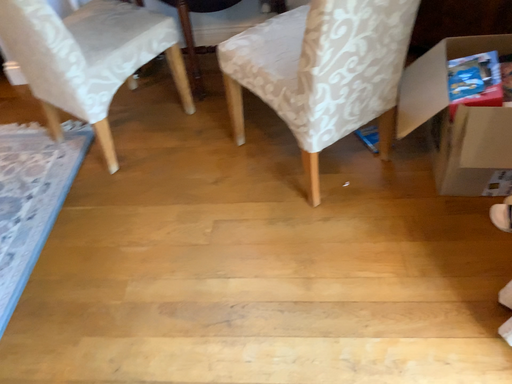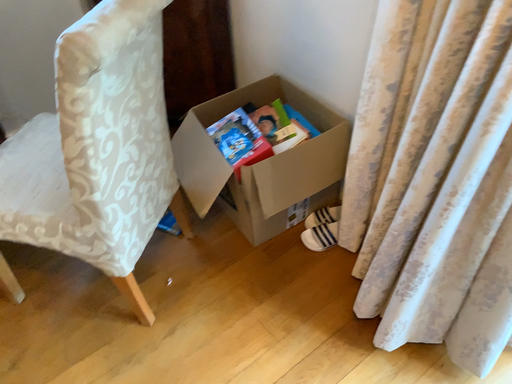
Question: How did the camera likely rotate when shooting the video?

Choices:
 (A) rotated left
 (B) rotated right

Answer: (B)